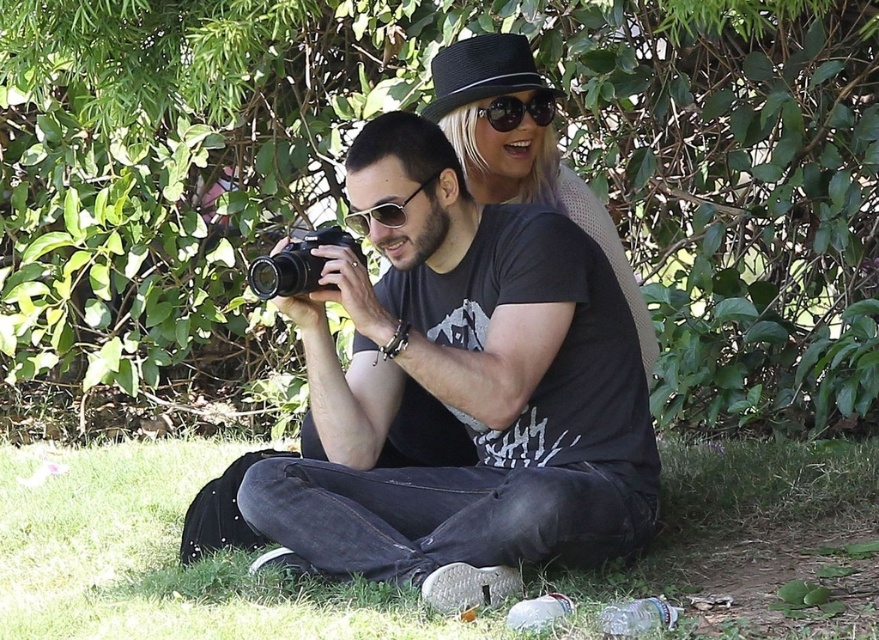
You are trying to decide which object to pick up first between the black matte camera at center and the sunglasses at center. Based on their sizes, which one should you choose if you want to pick up the taller object?

The black matte camera at center is taller than the sunglasses at center, so you should pick up the black matte camera at center first.

You are a photographer trying to capture a closeup shot of the sunglasses at center. Your camera, the black matte camera at center, has a minimum focusing distance of 20 inches. Will you be able to take the closeup without moving the camera or the sunglasses?

The black matte camera at center is 22.26 inches away from the sunglasses at center. Since the minimum focusing distance is 20 inches, the camera can focus at that distance. Therefore, you can take the closeup without moving either the camera or the sunglasses.